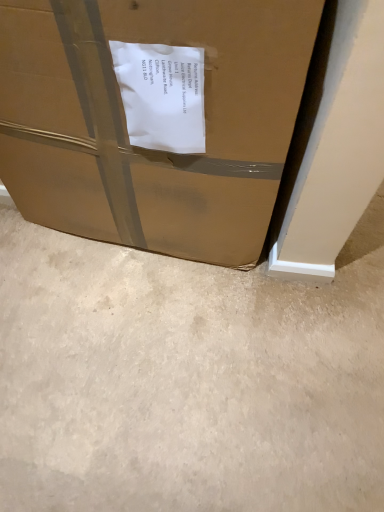
You are a GUI agent. You are given a task and a screenshot of the screen. Output one action in this format:
    pyautogui.click(x=<x>, y=<y>)
    Task: Click on the free space above beige carpet at lower center (from a real-world perspective)
    This screenshot has height=512, width=384.
    Given the screenshot: What is the action you would take?
    pyautogui.click(x=158, y=347)